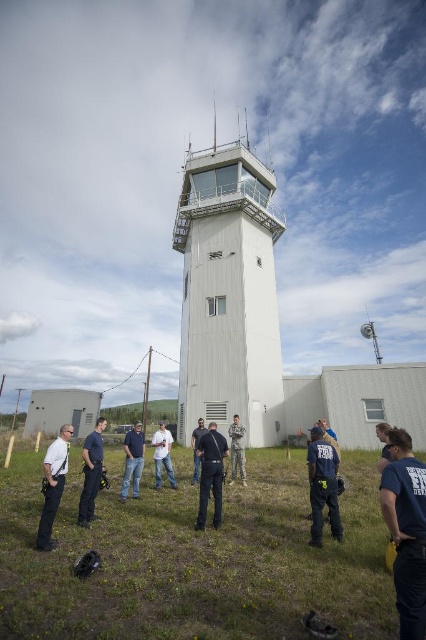
You are a photographer standing at the base of the control tower. You want to take a photo of the black fabric shirt at lower right and dark blue jeans at center in the same frame. Given that your camera has a maximum focus range of 4 meters, will both subjects be within the focus range?

The black fabric shirt at lower right and dark blue jeans at center are 3.98 meters apart from each other. Since the distance between them is less than 4 meters, both subjects will be within the camera focus range.

You are a photographer standing in front of the control tower and notice two people at lower right wearing dark blue clothing. Which item of clothing is closer to you, the dark blue uniform at lower right or the dark blue shirt at lower right?

The dark blue uniform at lower right is positioned over the dark blue shirt at lower right, meaning the dark blue uniform at lower right is closer to you.